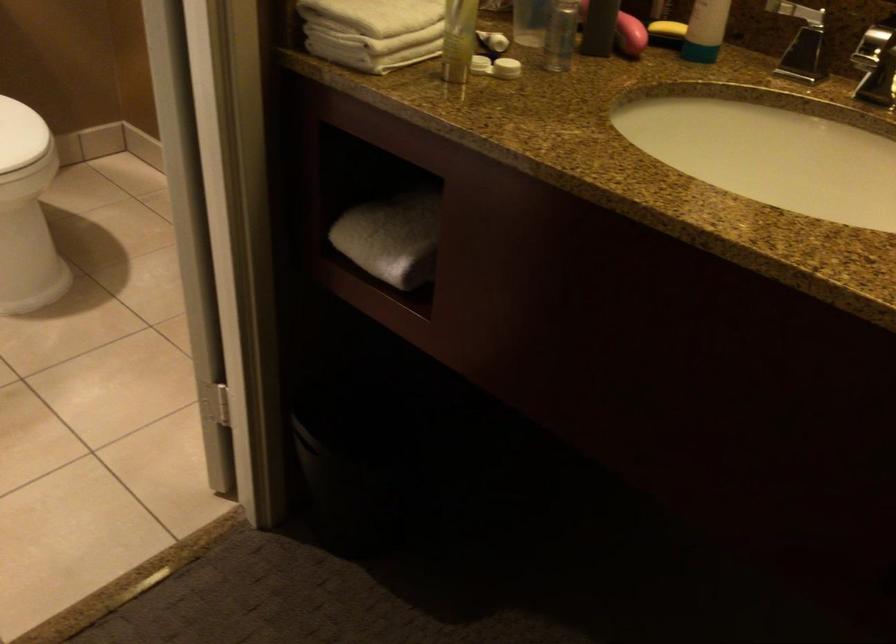
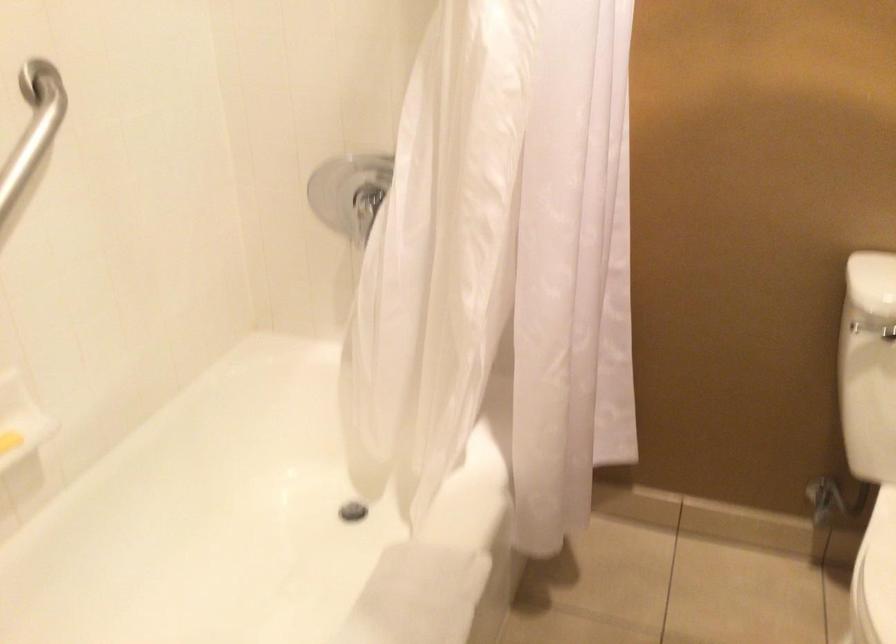
Question: Based on the continuous images, in which direction is the camera rotating? Reply with the corresponding letter.

Choices:
 (A) Left
 (B) Right
 (C) Up
 (D) Down

Answer: (A)